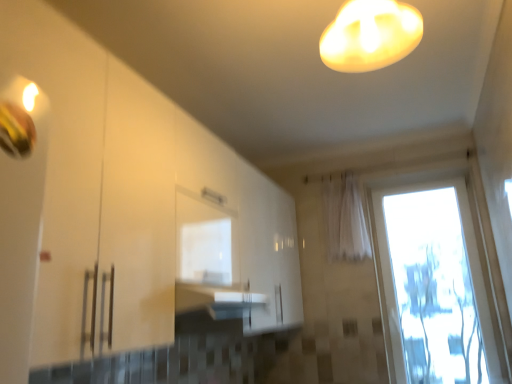
Question: Would you say transparent glass door at right is outside white glossy cabinet at center?

Choices:
 (A) no
 (B) yes

Answer: (B)

Question: Is transparent glass door at right wider than white glossy cabinet at center?

Choices:
 (A) no
 (B) yes

Answer: (A)

Question: Is transparent glass door at right not near white glossy cabinet at center?

Choices:
 (A) yes
 (B) no

Answer: (A)

Question: From the image's perspective, does transparent glass door at right appear lower than white glossy cabinet at center?

Choices:
 (A) yes
 (B) no

Answer: (A)

Question: Does transparent glass door at right appear on the right side of white glossy cabinet at center?

Choices:
 (A) yes
 (B) no

Answer: (A)

Question: Relative to white glossy cabinet at center, is transparent glass door at right in front or behind?

Choices:
 (A) behind
 (B) front

Answer: (A)

Question: From the image's perspective, is transparent glass door at right located above or below white glossy cabinet at center?

Choices:
 (A) below
 (B) above

Answer: (A)

Question: Considering the positions of transparent glass door at right and white glossy cabinet at center in the image, is transparent glass door at right wider or thinner than white glossy cabinet at center?

Choices:
 (A) thin
 (B) wide

Answer: (A)

Question: From their relative heights in the image, would you say transparent glass door at right is taller or shorter than white glossy cabinet at center?

Choices:
 (A) tall
 (B) short

Answer: (A)

Question: From a real-world perspective, is white glossy cabinet at center positioned above or below white sheer curtain at center?

Choices:
 (A) below
 (B) above

Answer: (A)

Question: In the image, is white glossy cabinet at center on the left side or the right side of white sheer curtain at center?

Choices:
 (A) right
 (B) left

Answer: (B)

Question: Is white glossy cabinet at center taller or shorter than white sheer curtain at center?

Choices:
 (A) tall
 (B) short

Answer: (A)

Question: In terms of width, does white glossy cabinet at center look wider or thinner when compared to white sheer curtain at center?

Choices:
 (A) wide
 (B) thin

Answer: (A)

Question: In the image, is white sheer curtain at center positioned in front of or behind white glossy lampshade at upper center?

Choices:
 (A) behind
 (B) front

Answer: (A)

Question: Considering the positions of point (350, 195) and point (387, 49), is point (350, 195) closer or farther from the camera than point (387, 49)?

Choices:
 (A) closer
 (B) farther

Answer: (B)